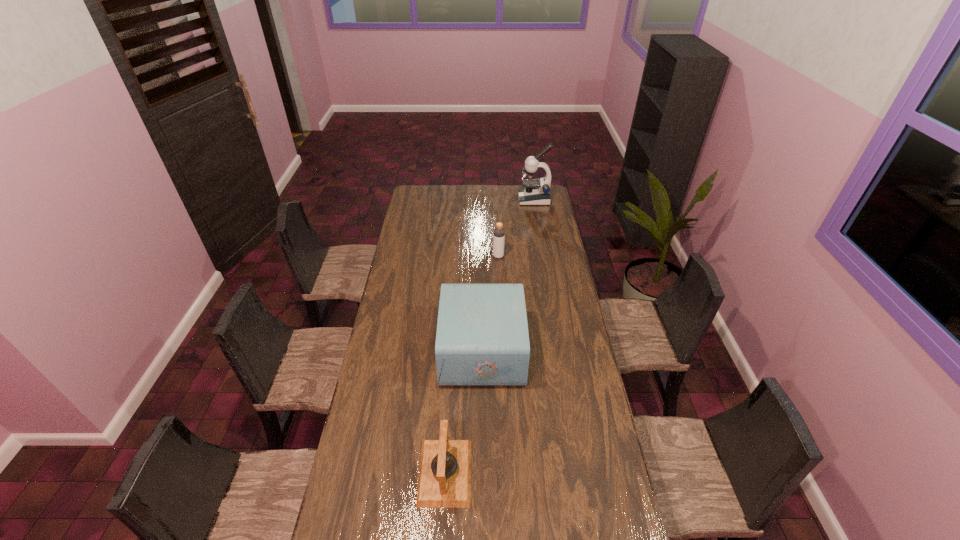
I want to click on blank region between the radio receiver and the bell, so click(x=464, y=411).

Where is `free space between the third nearest object and the rightmost object`? This screenshot has height=540, width=960. free space between the third nearest object and the rightmost object is located at coordinates (516, 228).

Where is `free spot between the radio receiver and the farthest object`? free spot between the radio receiver and the farthest object is located at coordinates (x=508, y=275).

Locate an element on the screen. free point between the microscope and the radio receiver is located at coordinates (508, 275).

The width and height of the screenshot is (960, 540). I want to click on empty space between the bottle and the rightmost object, so click(516, 228).

Point out which object is positioned as the third nearest to the bell. Please provide its 2D coordinates. Your answer should be formatted as a tuple, i.e. [(x, y)], where the tuple contains the x and y coordinates of a point satisfying the conditions above.

[(535, 192)]

What are the coordinates of `object that is the second nearest to the bottle` in the screenshot? It's located at (535, 192).

Where is `vacant position in the image that satisfies the following two spatial constraints: 1. at the eyepiece of the rightmost object; 2. on the front side of the nearest object`? This screenshot has height=540, width=960. vacant position in the image that satisfies the following two spatial constraints: 1. at the eyepiece of the rightmost object; 2. on the front side of the nearest object is located at coordinates point(582,472).

The image size is (960, 540). In order to click on free spot that satisfies the following two spatial constraints: 1. at the eyepiece of the farthest object; 2. on the front side of the shortest object in this screenshot , I will do `click(582, 472)`.

What are the coordinates of `vacant position in the image that satisfies the following two spatial constraints: 1. on the front side of the second farthest object; 2. on the front panel of the radio receiver` in the screenshot? It's located at (503, 350).